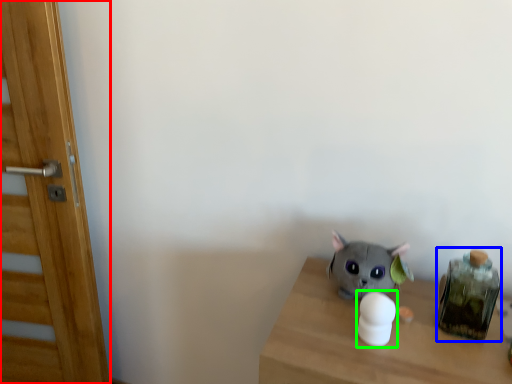
Question: Which object is the closest to the door (highlighted by a red box)? Choose among these: glass jar (highlighted by a blue box) or toy (highlighted by a green box).

Choices:
 (A) glass jar
 (B) toy

Answer: (B)